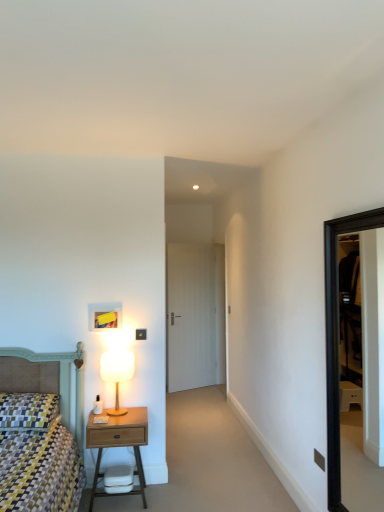
Question: From the image's perspective, is wooden nightstand at lower left under white wood door at center?

Choices:
 (A) yes
 (B) no

Answer: (A)

Question: Considering the relative sizes of wooden nightstand at lower left and white wood door at center in the image provided, is wooden nightstand at lower left wider than white wood door at center?

Choices:
 (A) yes
 (B) no

Answer: (A)

Question: Is wooden nightstand at lower left aimed at white wood door at center?

Choices:
 (A) yes
 (B) no

Answer: (B)

Question: Can you see wooden nightstand at lower left touching white wood door at center?

Choices:
 (A) yes
 (B) no

Answer: (B)

Question: Considering the relative positions of wooden nightstand at lower left and white wood door at center in the image provided, is wooden nightstand at lower left to the right of white wood door at center from the viewer's perspective?

Choices:
 (A) yes
 (B) no

Answer: (B)

Question: Looking at their shapes, would you say matte black switch at upper center is wider or thinner than patterned fabric pillow at lower left?

Choices:
 (A) thin
 (B) wide

Answer: (A)

Question: From the image's perspective, relative to patterned fabric pillow at lower left, is matte black switch at upper center above or below?

Choices:
 (A) above
 (B) below

Answer: (B)

Question: Considering their positions, is matte black switch at upper center located in front of or behind patterned fabric pillow at lower left?

Choices:
 (A) behind
 (B) front

Answer: (B)

Question: From a real-world perspective, is matte black switch at upper center above or below patterned fabric pillow at lower left?

Choices:
 (A) below
 (B) above

Answer: (A)

Question: Would you say matte black switch at upper center is to the left or to the right of wooden nightstand at lower left in the picture?

Choices:
 (A) left
 (B) right

Answer: (B)

Question: Is point (317, 457) closer or farther from the camera than point (92, 442)?

Choices:
 (A) closer
 (B) farther

Answer: (A)

Question: From a real-world perspective, relative to wooden nightstand at lower left, is matte black switch at upper center vertically above or below?

Choices:
 (A) above
 (B) below

Answer: (A)

Question: Which is correct: matte black switch at upper center is inside wooden nightstand at lower left, or outside of it?

Choices:
 (A) inside
 (B) outside

Answer: (B)

Question: Is black frame door at right to the left or to the right of wooden nightstand at lower left in the image?

Choices:
 (A) left
 (B) right

Answer: (B)

Question: In the image, is black frame door at right positioned in front of or behind wooden nightstand at lower left?

Choices:
 (A) front
 (B) behind

Answer: (A)